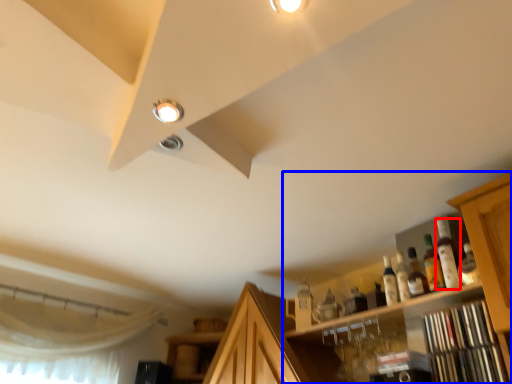
Question: Which of the following is the farthest to the observer, bottle (highlighted by a red box) or cabinetry (highlighted by a blue box)?

Choices:
 (A) bottle
 (B) cabinetry

Answer: (A)